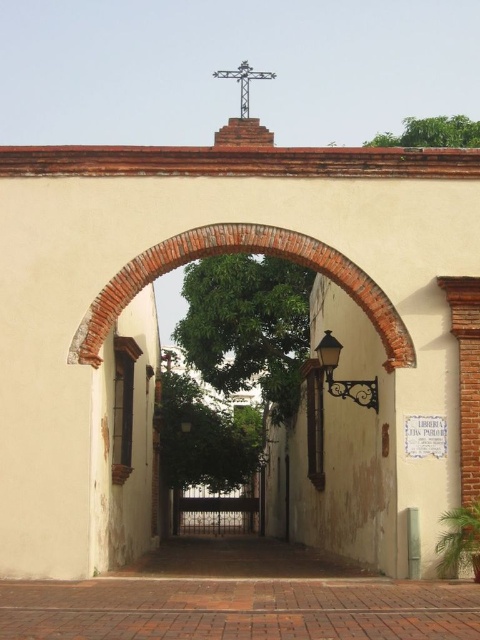
You are standing in front of the historic archway and want to take a photo. There are two points marked on the archway, one at coordinates point (12, 596) and another at point (360, 400). Which point is closer to your camera position?

Point (12, 596) is closer to the camera than point (360, 400).

You are an interior designer planning to place a small statue exactly between the brick at lower center and the matte black lamp at center. Which object should the statue be closer to?

The statue should be closer to the matte black lamp at center because the brick at lower center is bigger than the matte black lamp at center, so the distance between them would require the statue to be placed nearer to the smaller object to maintain balance.

In the scene shown: You are standing in front of the historic archway and want to hang a small decoration below the brick archway at center. There is a matte black lamp at center already present. Can you place your decoration above the lamp without it touching the brick archway?

The brick archway at center is above the matte black lamp at center, so there is space between them. You can place your decoration above the lamp but below the archway to avoid contact.